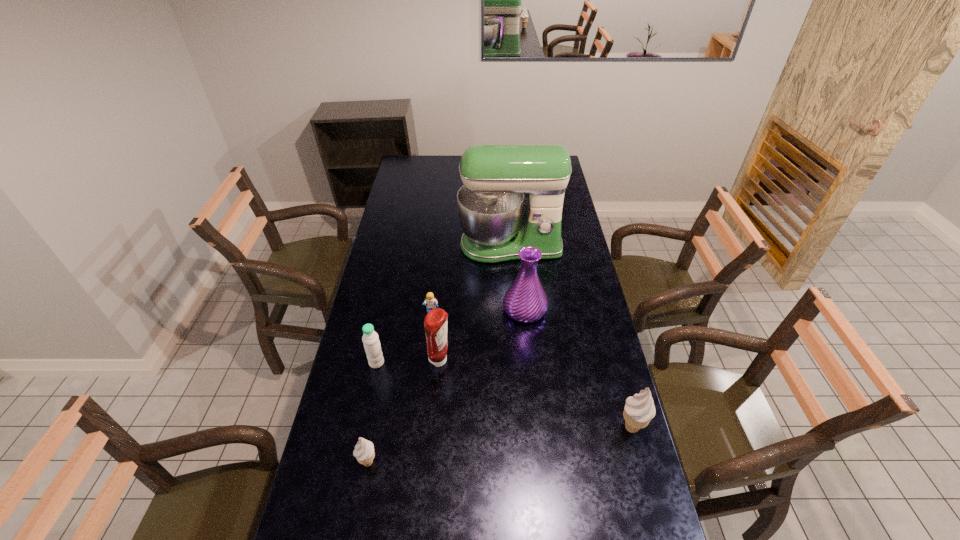
This screenshot has width=960, height=540. What are the coordinates of `the second shortest object` in the screenshot? It's located at (364, 452).

Identify the location of the nearer icecream. (364, 452).

Locate an element on the screen. This screenshot has height=540, width=960. the sixth farthest object is located at coordinates (639, 410).

Where is `the rightmost object`? The width and height of the screenshot is (960, 540). the rightmost object is located at coordinates click(x=639, y=410).

Find the location of a particular element. This screenshot has width=960, height=540. the second tallest object is located at coordinates (525, 301).

Find the location of a particular element. The image size is (960, 540). mixer is located at coordinates (490, 204).

At what (x,y) coordinates should I click in order to perform the action: click on the tallest object. Please return your answer as a coordinate pair (x, y). The width and height of the screenshot is (960, 540). Looking at the image, I should click on (490, 204).

What are the coordinates of `Lego` in the screenshot? It's located at (431, 302).

You are a GUI agent. You are given a task and a screenshot of the screen. Output one action in this format:
    pyautogui.click(x=<x>, y=<y>)
    Task: Click on the condiment
    
    Given the screenshot: What is the action you would take?
    pyautogui.click(x=435, y=324)

Where is `water bottle`? This screenshot has width=960, height=540. water bottle is located at coordinates (370, 338).